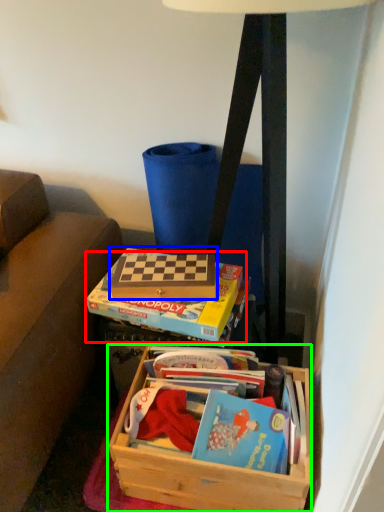
Question: Based on their relative distances, which object is nearer to paperback book (highlighted by a red box)? Choose from paperback book (highlighted by a blue box) and box (highlighted by a green box).

Choices:
 (A) paperback book
 (B) box

Answer: (A)